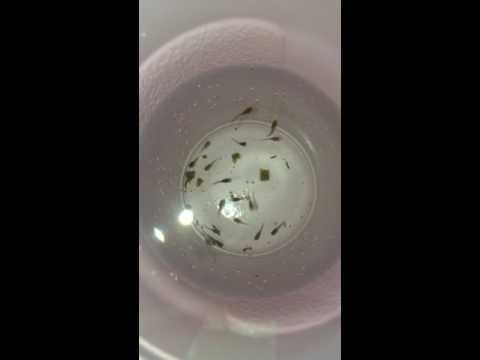
You are a GUI agent. You are given a task and a screenshot of the screen. Output one action in this format:
    pyautogui.click(x=<x>, y=<y>)
    Task: Click on the rim of bowl
    
    Given the screenshot: What is the action you would take?
    pyautogui.click(x=150, y=57), pyautogui.click(x=196, y=28), pyautogui.click(x=265, y=23), pyautogui.click(x=321, y=42)